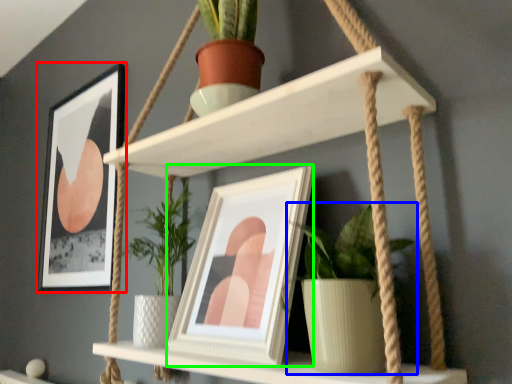
Question: Estimate the real-world distances between objects in this image. Which object is farther from picture frame (highlighted by a red box), houseplant (highlighted by a blue box) or picture frame (highlighted by a green box)?

Choices:
 (A) houseplant
 (B) picture frame

Answer: (A)